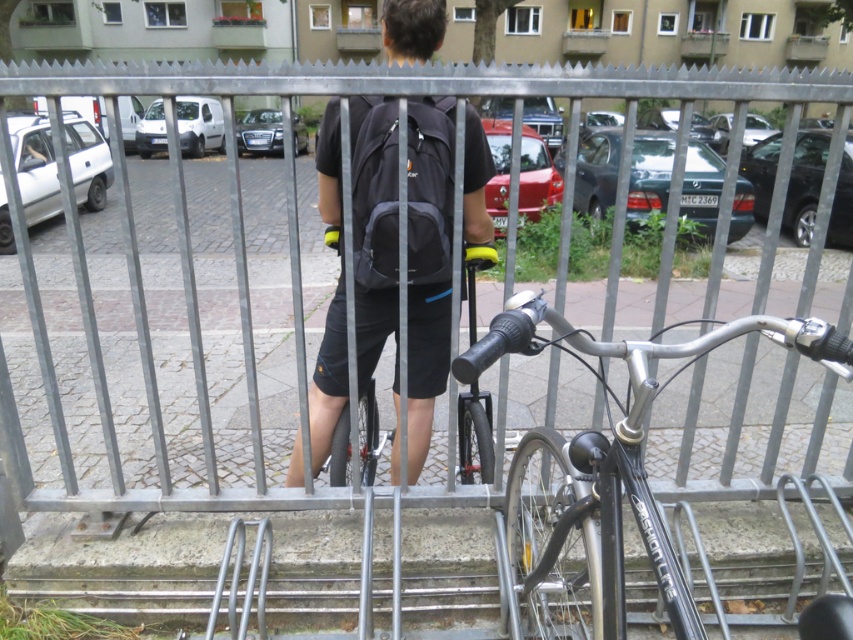
Question: Can you confirm if metallic silver fence at center is bigger than matte black backpack at center?

Choices:
 (A) yes
 (B) no

Answer: (A)

Question: Estimate the real-world distances between objects in this image. Which object is farther from the shiny metallic bicycle at center?

Choices:
 (A) matte black backpack at center
 (B) metallic silver fence at center

Answer: (A)

Question: Where is metallic silver fence at center located in relation to shiny metallic bicycle at center in the image?

Choices:
 (A) left
 (B) right

Answer: (A)

Question: In this image, where is metallic silver fence at center located relative to shiny metallic bicycle at center?

Choices:
 (A) right
 (B) left

Answer: (B)

Question: Estimate the real-world distances between objects in this image. Which object is farther from the metallic silver fence at center?

Choices:
 (A) shiny metallic bicycle at center
 (B) matte black backpack at center

Answer: (A)

Question: Considering the real-world distances, which object is closest to the matte black backpack at center?

Choices:
 (A) shiny metallic bicycle at center
 (B) metallic silver fence at center

Answer: (B)